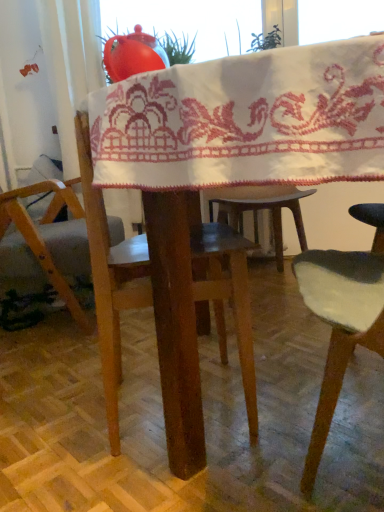
Question: Is wooden chair at left taller than wooden table at center?

Choices:
 (A) yes
 (B) no

Answer: (A)

Question: From the image's perspective, is wooden chair at left above wooden table at center?

Choices:
 (A) yes
 (B) no

Answer: (A)

Question: From the image's perspective, would you say wooden chair at left is shown under wooden table at center?

Choices:
 (A) no
 (B) yes

Answer: (A)

Question: Is wooden chair at left not near wooden table at center?

Choices:
 (A) yes
 (B) no

Answer: (B)

Question: Is wooden chair at left not inside wooden table at center?

Choices:
 (A) yes
 (B) no

Answer: (A)

Question: Is white embroidered cloth at center inside or outside of wooden chair at left?

Choices:
 (A) inside
 (B) outside

Answer: (B)

Question: From the image's perspective, is white embroidered cloth at center above or below wooden chair at left?

Choices:
 (A) below
 (B) above

Answer: (B)

Question: Is white embroidered cloth at center taller or shorter than wooden chair at left?

Choices:
 (A) short
 (B) tall

Answer: (A)

Question: From a real-world perspective, is white embroidered cloth at center positioned above or below wooden chair at left?

Choices:
 (A) below
 (B) above

Answer: (B)

Question: Is point (43, 252) closer or farther from the camera than point (332, 76)?

Choices:
 (A) closer
 (B) farther

Answer: (B)

Question: Which is correct: wooden chair at left is inside white embroidered cloth at center, or outside of it?

Choices:
 (A) inside
 (B) outside

Answer: (B)

Question: From the image's perspective, is wooden chair at left above or below white embroidered cloth at center?

Choices:
 (A) below
 (B) above

Answer: (A)

Question: Is wooden chair at left in front of or behind white embroidered cloth at center in the image?

Choices:
 (A) front
 (B) behind

Answer: (B)

Question: Would you say wooden table at center is inside or outside white embroidered cloth at center?

Choices:
 (A) outside
 (B) inside

Answer: (A)

Question: Relative to white embroidered cloth at center, is wooden table at center in front or behind?

Choices:
 (A) front
 (B) behind

Answer: (A)